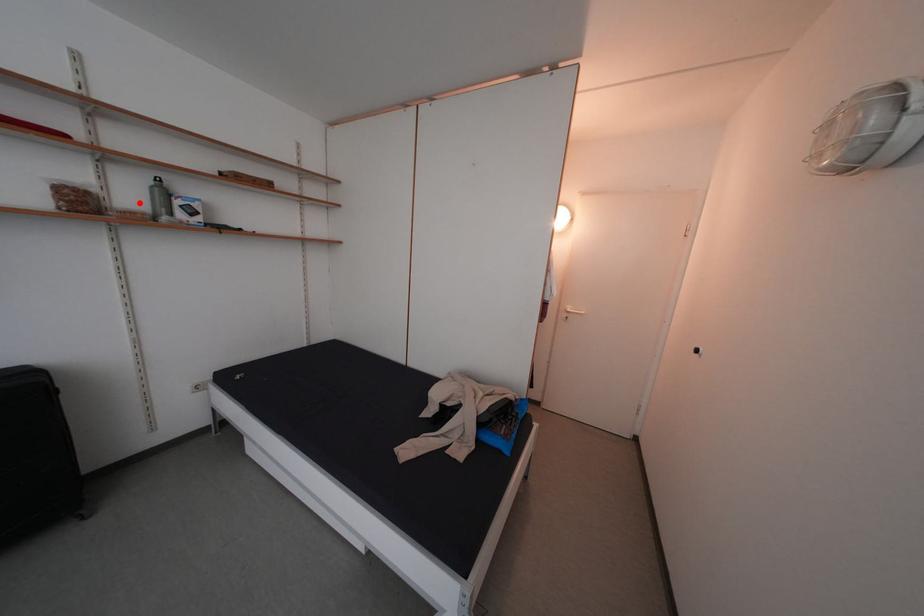
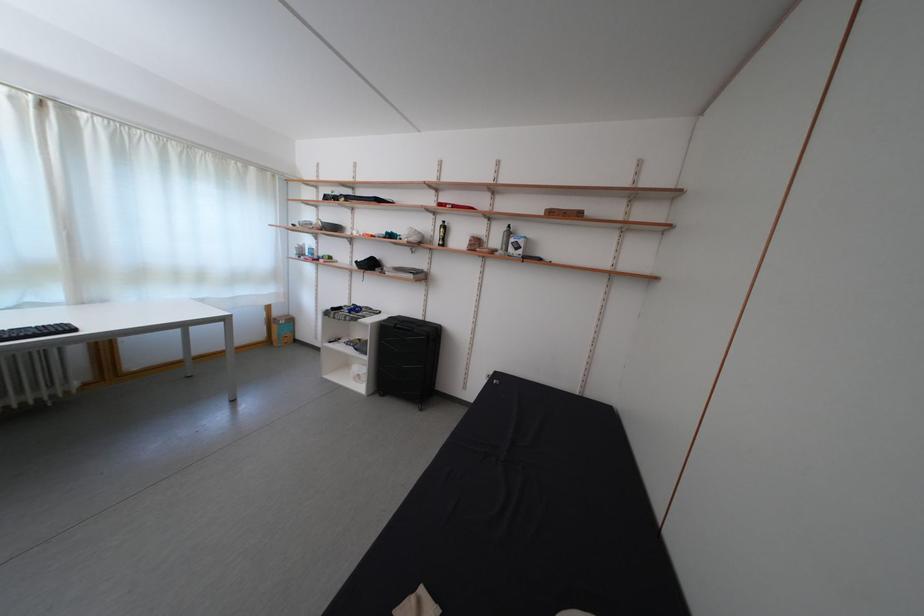
Find the pixel in the second image that matches the highlighted location in the first image.

(505, 246)